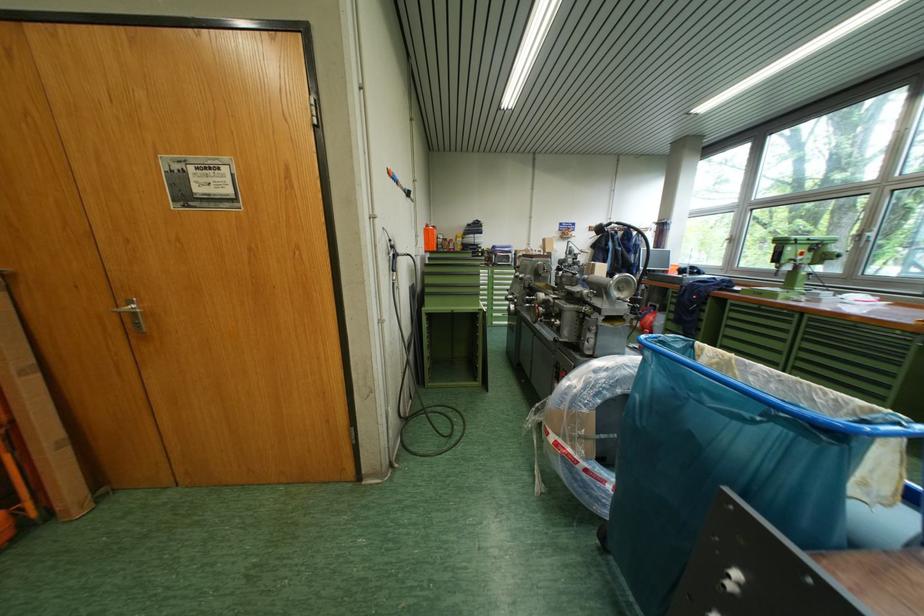
This screenshot has width=924, height=616. Identify the location of orange extinguisher handle. (429, 238).